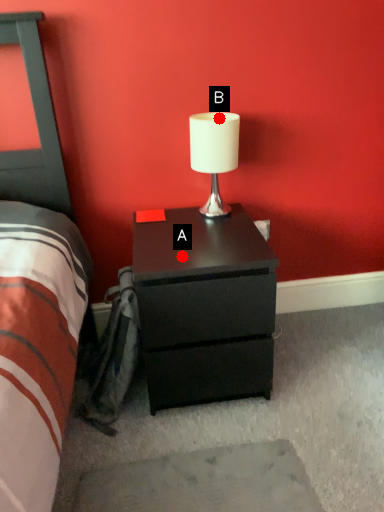
Question: Two points are circled on the image, labeled by A and B beside each circle. Which point is farther to the camera?

Choices:
 (A) A is further
 (B) B is further

Answer: (B)